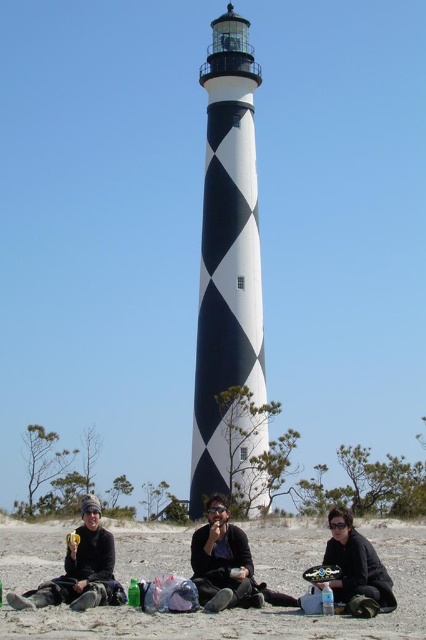
You are a photographer trying to capture a photo of the matte black jacket at lower left and the matte black sunglasses at center. Based on their sizes, which object should you focus on first to ensure it appears larger in the photo?

The matte black jacket at lower left is taller than the matte black sunglasses at center, so focusing on it first will ensure it appears larger in the photo.

You are a photographer planning to capture the black sand at lower center and the matte black sunglasses at center in the same frame. Which object will appear closer to the bottom edge of the photo?

The black sand at lower center is shorter than the matte black sunglasses at center, so the black sand at lower center will appear closer to the bottom edge of the photo.

You are a photographer trying to capture the black sand at lower center and the matte black sunglasses at center in the same frame. Based on their positions, which object would appear larger in your photo?

The black sand at lower center appears larger in the photo because it is closer to the viewer than the matte black sunglasses at center.